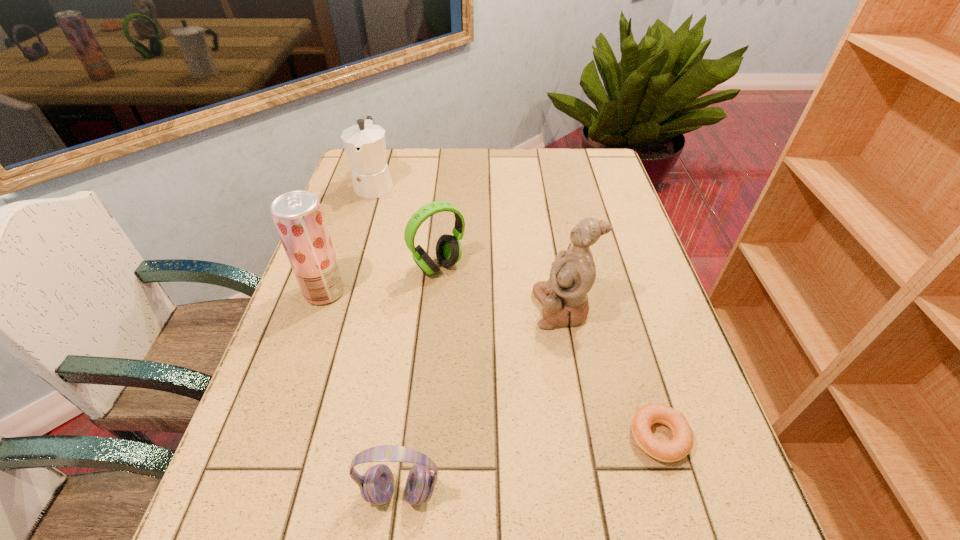
Find the location of a particular element. This screenshot has height=540, width=960. free space located on the front-facing side of the second object from right to left is located at coordinates click(410, 308).

Locate an element on the screen. vacant region located 0.250m on the front-facing side of the second object from right to left is located at coordinates (430, 308).

Image resolution: width=960 pixels, height=540 pixels. What are the coordinates of `vacant space situated 0.340m on the front-facing side of the second object from right to left` in the screenshot? It's located at (394, 308).

The height and width of the screenshot is (540, 960). Identify the location of free space located 0.370m at the spout of the farthest object. (343, 291).

The image size is (960, 540). What are the coordinates of `vacant region located 0.260m on the front of the taller headset` in the screenshot? It's located at point(429,368).

Locate an element on the screen. The height and width of the screenshot is (540, 960). vacant region located on the left of the second nearest object is located at coordinates (583, 437).

Identify the location of object located in the far edge section of the desktop. The height and width of the screenshot is (540, 960). (365, 145).

Where is `fruit juice that is at the left edge`? fruit juice that is at the left edge is located at coordinates (298, 217).

You are a GUI agent. You are given a task and a screenshot of the screen. Output one action in this format:
    pyautogui.click(x=<x>, y=<y>)
    Task: Click on the coffeepot at the left edge
    This screenshot has width=960, height=540.
    Given the screenshot: What is the action you would take?
    pyautogui.click(x=365, y=145)

Find the location of a particular element. object present at the right edge is located at coordinates (680, 446).